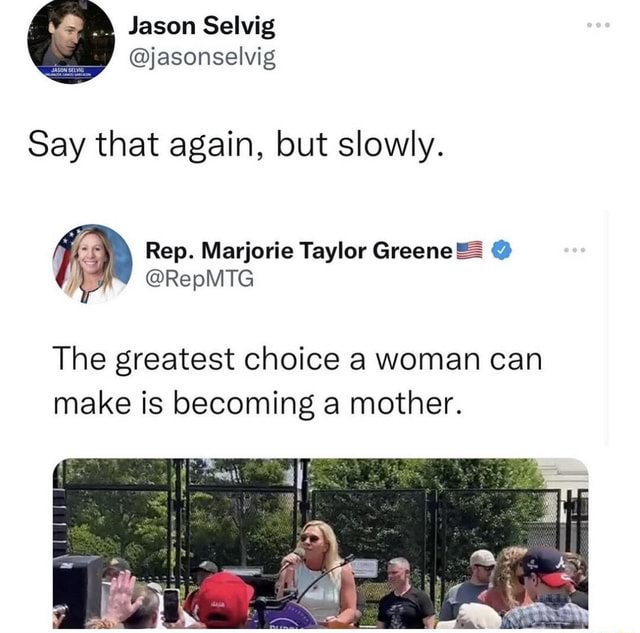
The width and height of the screenshot is (640, 633). I want to click on wall, so click(x=559, y=484).